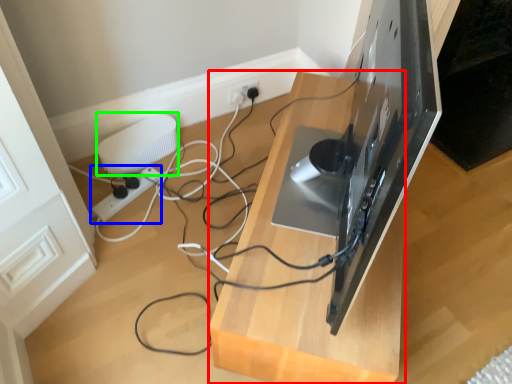
Question: Which object is positioned closest to furniture (highlighted by a red box)? Select from extension cord (highlighted by a blue box) and appliance (highlighted by a green box).

Choices:
 (A) extension cord
 (B) appliance

Answer: (B)